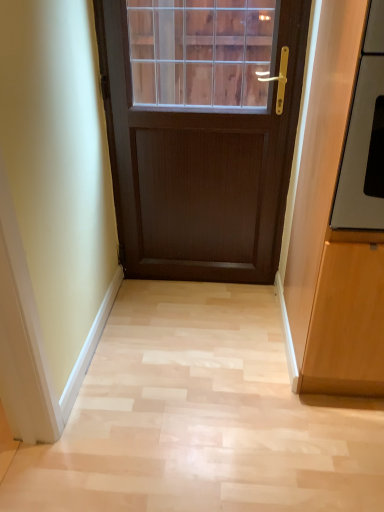
This screenshot has width=384, height=512. What are the coordinates of `free space in front of matte wood cabinet at right` in the screenshot? It's located at (319, 456).